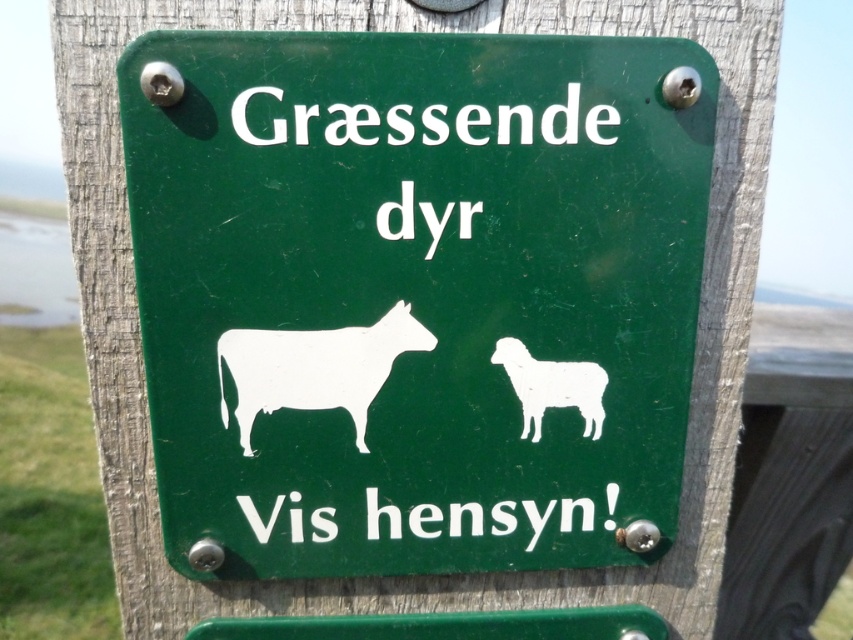
Is point (311, 108) more distant than point (498, 339)?

No, (311, 108) is closer to viewer.

Does green matte sign at center appear under white matte sheep at center?

Actually, green matte sign at center is above white matte sheep at center.

Does point (422, 371) come behind point (541, 385)?

No.

Where is `green matte sign at center`? Image resolution: width=853 pixels, height=640 pixels. green matte sign at center is located at coordinates click(413, 292).

Is white paper sheep at center above white matte sheep at center?

Yes, white paper sheep at center is above white matte sheep at center.

This screenshot has height=640, width=853. Identify the location of white paper sheep at center. (315, 368).

Image resolution: width=853 pixels, height=640 pixels. Find the location of `white paper sheep at center`. white paper sheep at center is located at coordinates (315, 368).

Can you confirm if green matte sign at center is taller than white paper sheep at center?

Yes.

Does green matte sign at center appear over white paper sheep at center?

Correct, green matte sign at center is located above white paper sheep at center.

Where is `green matte sign at center`? green matte sign at center is located at coordinates (413, 292).